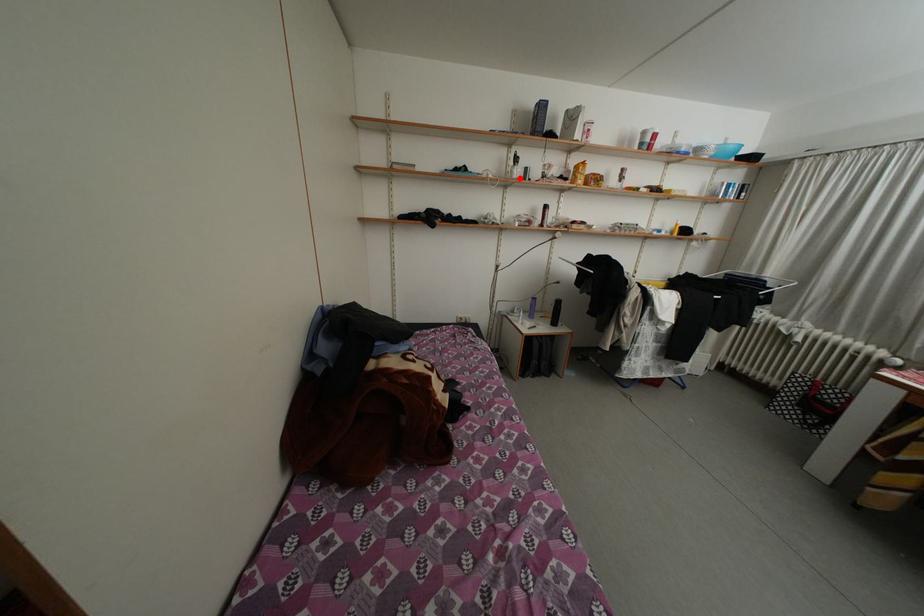
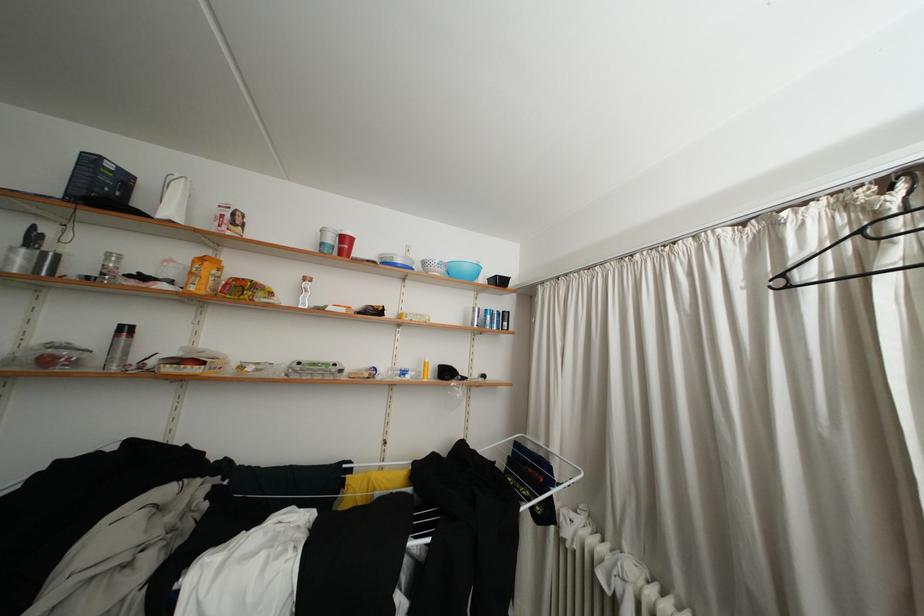
Question: I am providing you with two images of the same scene from different viewpoints. A red point is marked on the first image. Is the red point's position out of view in image 2?

Choices:
 (A) Yes
 (B) No

Answer: (B)